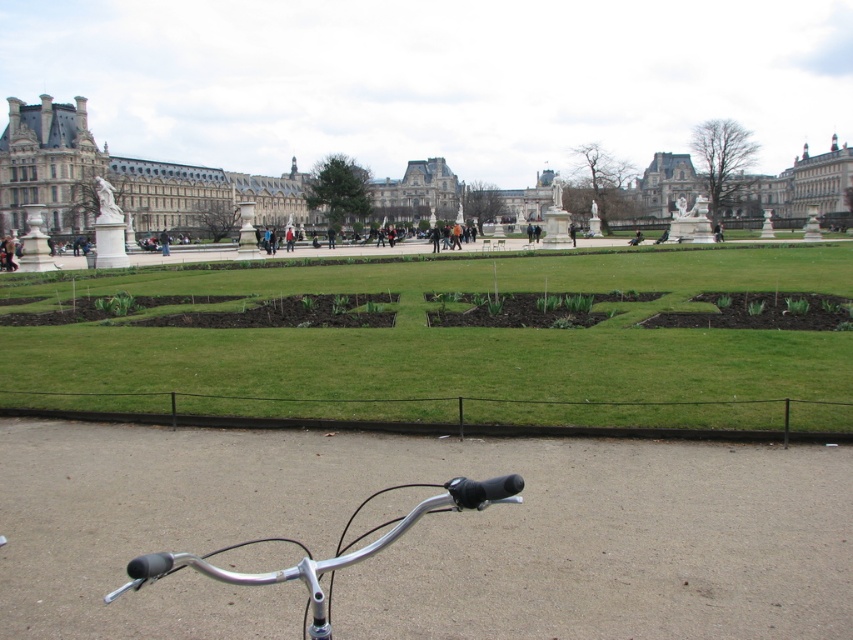
You are riding a bike and looking at the white stone palace at center and the silver metallic bicycle handlebars at lower center. Which object is taller?

The white stone palace at center is taller than the silver metallic bicycle handlebars at lower center.

You are a gardener planning to plant a small flower bed between the green grass at center and the silver metallic bicycle handlebars at lower center. Which area has more space available for planting?

The green grass at center has more space available for planting because it is bigger than the silver metallic bicycle handlebars at lower center.

You are planning to walk from the green grass at center to the white stone palace at center. Which path would you take to avoid the narrower area?

Since the green grass at center has a lesser width compared to the white stone palace at center, the narrower area is the green grass at center. To avoid it, you should walk along the wider white stone palace at center path.